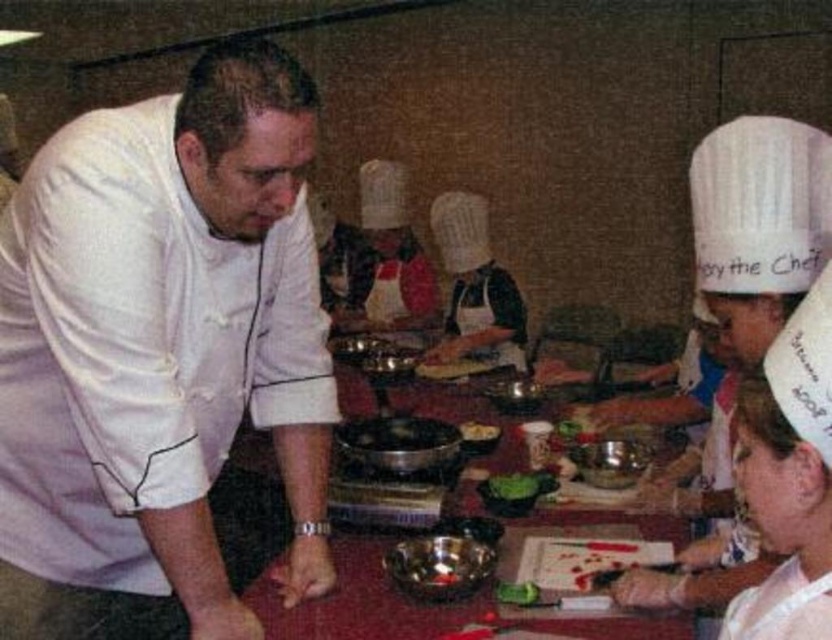
You are a participant in the cooking class and need to locate the metallic bowls at center. Where exactly are they placed on the table?

The metallic bowls at center are located at point (x=355, y=602) on the table.

Please provide the 2D coordinates of the white matte chef coat at left in the image. The coordinates should be in the format of a point with two decimal places, such as point x, y.

The white matte chef coat at left is located at point (161, 356).

You are a participant in the cooking class and need to place the smooth brown bread at center onto the metallic bowls at center. Can the bread fit on the bowl?

The metallic bowls at center is bigger than smooth brown bread at center, so the bread can fit on the bowl.